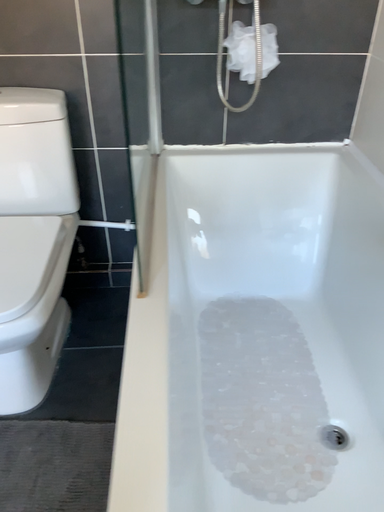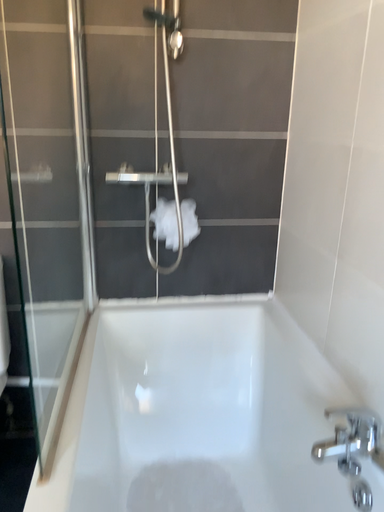
Question: Which way did the camera rotate in the video?

Choices:
 (A) rotated downward
 (B) rotated upward

Answer: (B)